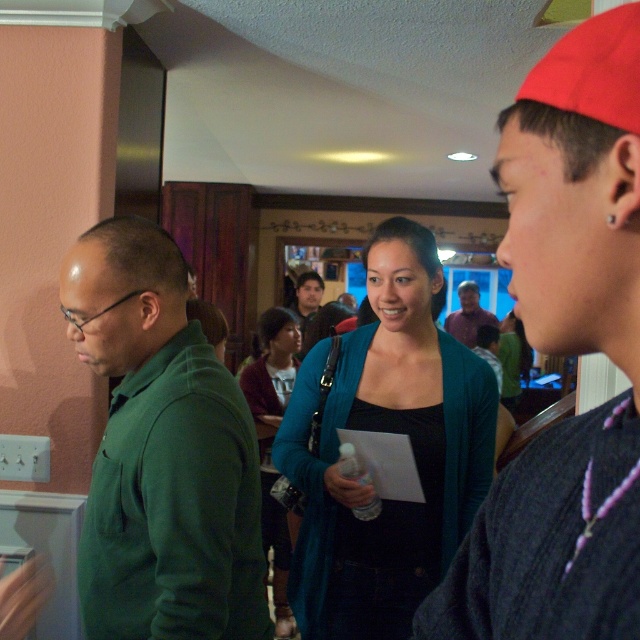
Is teal cardigan at center thinner than matte teal sweater at center?

In fact, teal cardigan at center might be wider than matte teal sweater at center.

Which is behind, point (452, 413) or point (269, 464)?

The point (269, 464) is more distant.

Where is `teal cardigan at center`? The image size is (640, 640). teal cardigan at center is located at coordinates (388, 432).

Looking at this image, can you confirm if green matte sweater at left is wider than matte teal sweater at center?

Correct, the width of green matte sweater at left exceeds that of matte teal sweater at center.

Does green matte sweater at left appear on the left side of matte teal sweater at center?

Yes, green matte sweater at left is to the left of matte teal sweater at center.

Is point (192, 468) less distant than point (257, 362)?

Yes, it is in front of point (257, 362).

This screenshot has height=640, width=640. What are the coordinates of `green matte sweater at left` in the screenshot? It's located at (161, 452).

Which of these two, teal cardigan at center or matte purple shirt at center, stands taller?

teal cardigan at center

Between teal cardigan at center and matte purple shirt at center, which one appears on the left side from the viewer's perspective?

teal cardigan at center

Find the location of a particular element. teal cardigan at center is located at coordinates (388, 432).

This screenshot has width=640, height=640. I want to click on teal cardigan at center, so pos(388,432).